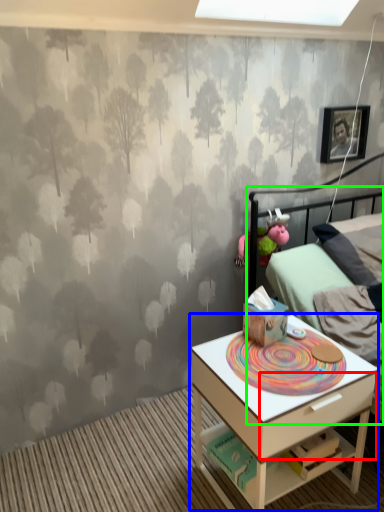
Question: Estimate the real-world distances between objects in this image. Which object is closer to drawer (highlighted by a red box), nightstand (highlighted by a blue box) or bed (highlighted by a green box)?

Choices:
 (A) nightstand
 (B) bed

Answer: (A)